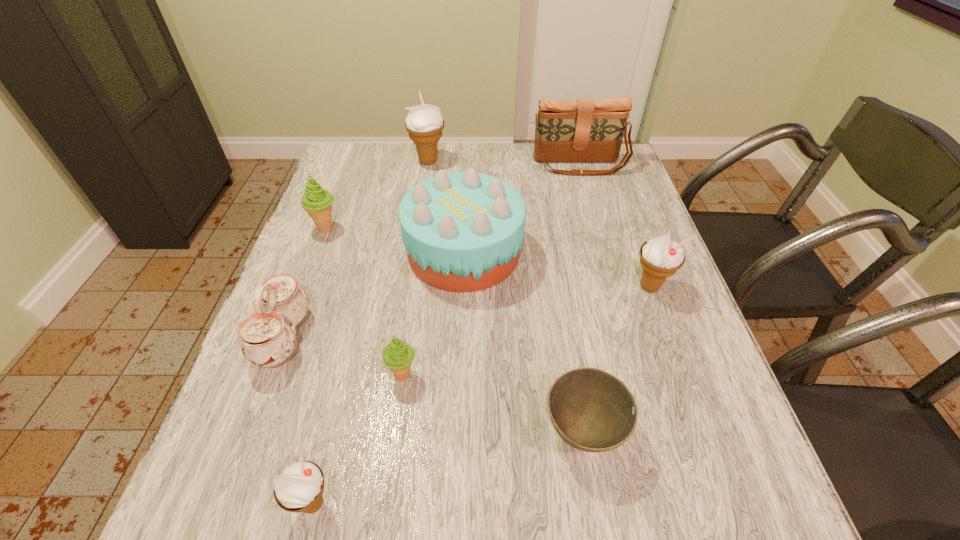
At what (x,y) coordinates should I click in order to perform the action: click on object that stands as the eighth closest to the farther green icecream. Please return your answer as a coordinate pair (x, y). The height and width of the screenshot is (540, 960). Looking at the image, I should click on (660, 257).

Point out which icecream is positioned as the fourth nearest to the second smallest white icecream. Please provide its 2D coordinates. Your answer should be formatted as a tuple, i.e. [(x, y)], where the tuple contains the x and y coordinates of a point satisfying the conditions above.

[(317, 202)]

Choose which icecream is the second nearest neighbor to the white chinaware. Please provide its 2D coordinates. Your answer should be formatted as a tuple, i.e. [(x, y)], where the tuple contains the x and y coordinates of a point satisfying the conditions above.

[(301, 483)]

Identify which white icecream is the nearest to the fourth farthest icecream. Please provide its 2D coordinates. Your answer should be formatted as a tuple, i.e. [(x, y)], where the tuple contains the x and y coordinates of a point satisfying the conditions above.

[(301, 483)]

Select which white icecream appears as the third closest to the right green icecream. Please provide its 2D coordinates. Your answer should be formatted as a tuple, i.e. [(x, y)], where the tuple contains the x and y coordinates of a point satisfying the conditions above.

[(424, 123)]

Find the location of a particular element. Image resolution: width=960 pixels, height=540 pixels. free location that satisfies the following two spatial constraints: 1. by the handle of the eighth farthest object; 2. on the right side of the chinaware is located at coordinates (249, 431).

Where is `vacant area that satisfies the following two spatial constraints: 1. by the handle of the chinaware; 2. on the back side of the nearer green icecream`? The height and width of the screenshot is (540, 960). vacant area that satisfies the following two spatial constraints: 1. by the handle of the chinaware; 2. on the back side of the nearer green icecream is located at coordinates (270, 375).

You are a GUI agent. You are given a task and a screenshot of the screen. Output one action in this format:
    pyautogui.click(x=<x>, y=<y>)
    Task: Click on the blank space that satisfies the following two spatial constraints: 1. on the front side of the bowl; 2. on the right side of the second farthest icecream
    
    Given the screenshot: What is the action you would take?
    pyautogui.click(x=251, y=431)

Locate an element on the screen. vacant space that satisfies the following two spatial constraints: 1. on the back side of the right green icecream; 2. by the handle of the chinaware is located at coordinates (408, 337).